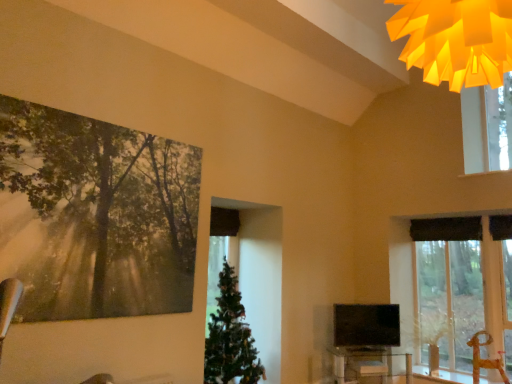
At what (x,y) coordinates should I click in order to perform the action: click on clear glass table at lower center. Please return your answer as a coordinate pair (x, y). This screenshot has height=384, width=512. Looking at the image, I should click on (365, 364).

Measure the distance between point [487,364] and camera.

A distance of 4.50 meters exists between point [487,364] and camera.

This screenshot has height=384, width=512. Identify the location of black textured curtain at upper center. (446, 229).

Describe the element at coordinates (446, 229) in the screenshot. This screenshot has height=384, width=512. I see `black textured curtain at upper center` at that location.

Identify the location of matte forest painting at upper left. (95, 215).

Between matte forest painting at upper left and matte black tv at center, which one has larger width?

Wider between the two is matte black tv at center.

Would you say matte forest painting at upper left contains matte black tv at center?

No.

Can you confirm if matte forest painting at upper left is shorter than matte black tv at center?

Incorrect, the height of matte forest painting at upper left does not fall short of that of matte black tv at center.

Is the surface of matte forest painting at upper left in direct contact with clear glass table at lower center?

No, matte forest painting at upper left is not with clear glass table at lower center.

Is matte forest painting at upper left wider than clear glass table at lower center?

Incorrect, the width of matte forest painting at upper left does not surpass that of clear glass table at lower center.

Can we say matte forest painting at upper left lies outside clear glass table at lower center?

matte forest painting at upper left lies outside clear glass table at lower center's area.

Based on their sizes in the image, would you say matte forest painting at upper left is bigger or smaller than clear glass table at lower center?

Considering their sizes, matte forest painting at upper left takes up less space than clear glass table at lower center.

Considering the sizes of objects matte forest painting at upper left and black textured curtain at upper center in the image provided, who is bigger, matte forest painting at upper left or black textured curtain at upper center?

matte forest painting at upper left.

How far apart are matte forest painting at upper left and black textured curtain at upper center?

matte forest painting at upper left is 3.64 meters from black textured curtain at upper center.

Could you tell me if matte forest painting at upper left is turned towards black textured curtain at upper center?

No, matte forest painting at upper left is not facing towards black textured curtain at upper center.

In terms of height, does matte forest painting at upper left look taller or shorter compared to black textured curtain at upper center?

Clearly, matte forest painting at upper left is taller compared to black textured curtain at upper center.

Is clear glass table at lower center taller than matte black tv at center?

Incorrect, the height of clear glass table at lower center is not larger of that of matte black tv at center.

Can you confirm if clear glass table at lower center is positioned to the right of matte black tv at center?

No, clear glass table at lower center is not to the right of matte black tv at center.

Can you tell me how much clear glass table at lower center and matte black tv at center differ in facing direction?

clear glass table at lower center and matte black tv at center are facing 0.215 degrees away from each other.

From the image's perspective, does clear glass table at lower center appear lower than matte black tv at center?

Correct, clear glass table at lower center appears lower than matte black tv at center in the image.

Which is more to the left, black textured curtain at upper center or matte black tv at center?

matte black tv at center.

From the image's perspective, relative to matte black tv at center, is black textured curtain at upper center above or below?

black textured curtain at upper center is situated higher than matte black tv at center in the image.

Which is behind, point (426, 221) or point (340, 331)?

The point (426, 221) is farther from the camera.

Can you tell me how much black textured curtain at upper center and matte black tv at center differ in facing direction?

58.8 degrees separate the facing orientations of black textured curtain at upper center and matte black tv at center.

Who is shorter, black textured curtain at upper center or matte forest painting at upper left?

black textured curtain at upper center is shorter.

Does black textured curtain at upper center have a greater width compared to matte forest painting at upper left?

Indeed, black textured curtain at upper center has a greater width compared to matte forest painting at upper left.

Are black textured curtain at upper center and matte forest painting at upper left located far from each other?

Yes.

Is point (457, 230) more distant than point (94, 127)?

Yes, it is behind point (94, 127).

Looking at their sizes, would you say metallic silver swivel chair at lower right is wider or thinner than green matte christmas tree at center?

Clearly, metallic silver swivel chair at lower right has less width compared to green matte christmas tree at center.

Considering the positions of points (502, 359) and (254, 375), is point (502, 359) farther from camera compared to point (254, 375)?

Yes, point (502, 359) is behind point (254, 375).

Is metallic silver swivel chair at lower right not within green matte christmas tree at center?

Indeed, metallic silver swivel chair at lower right is completely outside green matte christmas tree at center.

I want to click on television below the matte forest painting at upper left (from the image's perspective), so click(366, 325).

The image size is (512, 384). I want to click on table below the matte forest painting at upper left (from a real-world perspective), so click(x=365, y=364).

Estimate the real-world distances between objects in this image. Which object is closer to metallic silver swivel chair at lower right, matte forest painting at upper left or matte black tv at center?

matte black tv at center is positioned closer to the anchor metallic silver swivel chair at lower right.

Which object lies nearer to the anchor point clear glass table at lower center, matte black tv at center or black textured curtain at upper center?

matte black tv at center lies closer to clear glass table at lower center than the other object.

From the image, which object appears to be farther from matte forest painting at upper left, clear glass table at lower center or green matte christmas tree at center?

clear glass table at lower center is positioned further to the anchor matte forest painting at upper left.

From the image, which object appears to be farther from black textured curtain at upper center, matte black tv at center or metallic silver swivel chair at lower right?

matte black tv at center lies further to black textured curtain at upper center than the other object.

Estimate the real-world distances between objects in this image. Which object is further from matte forest painting at upper left, metallic silver swivel chair at lower right or green matte christmas tree at center?

metallic silver swivel chair at lower right is positioned further to the anchor matte forest painting at upper left.

Which object lies nearer to the anchor point metallic silver swivel chair at lower right, clear glass table at lower center or matte black tv at center?

Among the two, matte black tv at center is located nearer to metallic silver swivel chair at lower right.

Considering their positions, is matte forest painting at upper left positioned closer to black textured curtain at upper center than green matte christmas tree at center?

green matte christmas tree at center lies closer to black textured curtain at upper center than the other object.

From the image, which object appears to be farther from clear glass table at lower center, matte forest painting at upper left or metallic silver swivel chair at lower right?

matte forest painting at upper left lies further to clear glass table at lower center than the other object.

Identify the location of swivel chair between black textured curtain at upper center and clear glass table at lower center from top to bottom. This screenshot has width=512, height=384. (485, 359).

Locate an element on the screen. table located between green matte christmas tree at center and matte black tv at center in the left-right direction is located at coordinates (365, 364).

Image resolution: width=512 pixels, height=384 pixels. Find the location of `table located between green matte christmas tree at center and black textured curtain at upper center in the left-right direction`. table located between green matte christmas tree at center and black textured curtain at upper center in the left-right direction is located at coordinates (365, 364).

This screenshot has height=384, width=512. I want to click on christmas tree situated between matte forest painting at upper left and metallic silver swivel chair at lower right from left to right, so click(x=230, y=337).